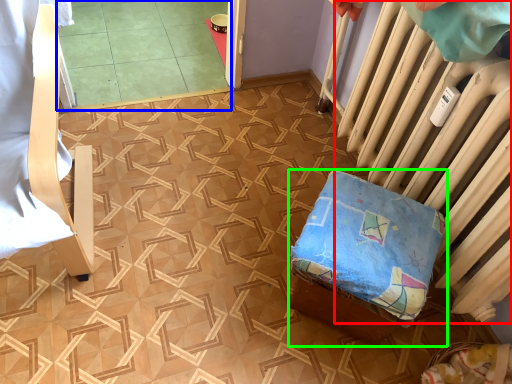
Question: Which object is the farthest from radiator (highlighted by a red box)? Choose among these: tile (highlighted by a blue box) or furniture (highlighted by a green box).

Choices:
 (A) tile
 (B) furniture

Answer: (A)